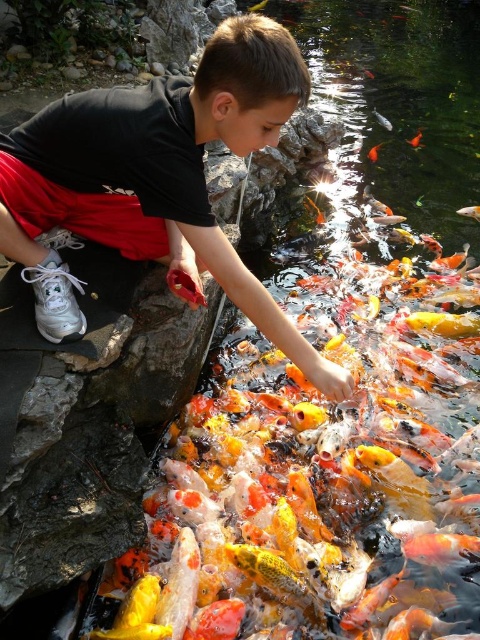
Question: Which object is farther from the camera taking this photo?

Choices:
 (A) shiny orange fish at center
 (B) orange and white scales at upper right
 (C) orange and white textured fish at center

Answer: (A)

Question: Among these objects, which one is farthest from the camera?

Choices:
 (A) black matte shirt at upper left
 (B) shiny orange fish at center

Answer: (B)

Question: Is black matte shirt at upper left wider than orange and white scales at upper right?

Choices:
 (A) no
 (B) yes

Answer: (B)

Question: In this image, where is orange and white textured fish at center located relative to orange and white scales at upper right?

Choices:
 (A) below
 (B) above

Answer: (A)

Question: Estimate the real-world distances between objects in this image. Which object is closer to the orange and white textured fish at center?

Choices:
 (A) shiny orange fish at center
 (B) orange and white scales at upper right
 (C) black matte shirt at upper left

Answer: (B)

Question: Considering the relative positions of orange and white textured fish at center and orange and white scales at upper right in the image provided, where is orange and white textured fish at center located with respect to orange and white scales at upper right?

Choices:
 (A) left
 (B) right

Answer: (B)